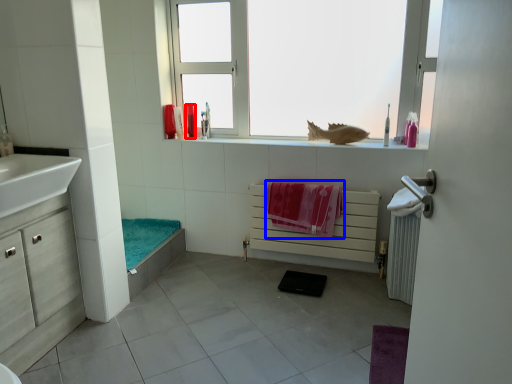
Question: Which of the following is the farthest to the observer, toiletry (highlighted by a red box) or beach towel (highlighted by a blue box)?

Choices:
 (A) toiletry
 (B) beach towel

Answer: (A)